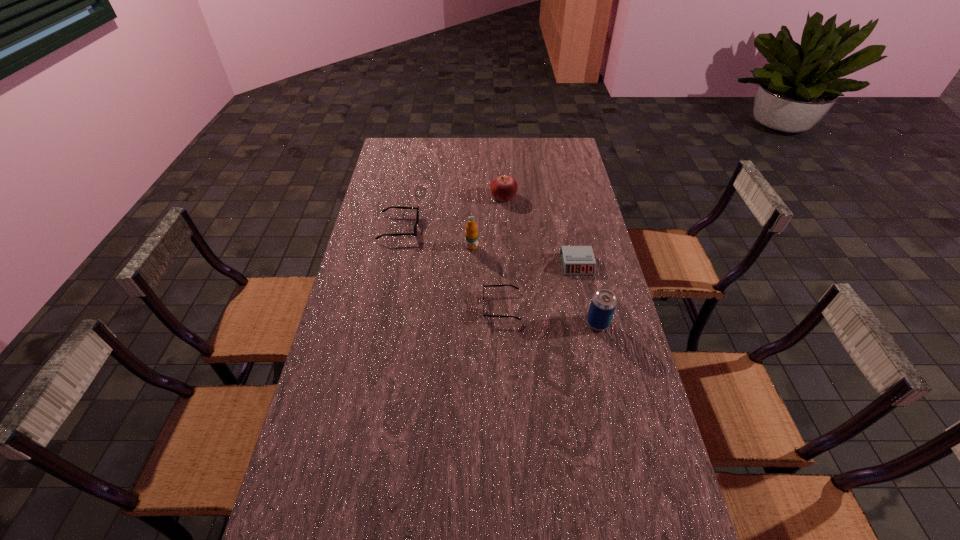
I want to click on the farther sunglasses, so click(x=414, y=233).

The image size is (960, 540). I want to click on the leftmost object, so click(x=414, y=233).

Identify the location of the nearer sunglasses. This screenshot has height=540, width=960. (501, 316).

The height and width of the screenshot is (540, 960). I want to click on the right sunglasses, so click(x=501, y=316).

The width and height of the screenshot is (960, 540). In order to click on the third tallest object in this screenshot , I will do `click(503, 188)`.

The image size is (960, 540). Identify the location of the farthest object. (503, 188).

Image resolution: width=960 pixels, height=540 pixels. I want to click on the fifth object from right to left, so click(471, 234).

Locate an element on the screen. The width and height of the screenshot is (960, 540). the third nearest object is located at coordinates (576, 260).

Locate an element on the screen. The height and width of the screenshot is (540, 960). beer can is located at coordinates (603, 303).

Locate an element on the screen. free space located 0.150m on the front-facing side of the leftmost object is located at coordinates (457, 228).